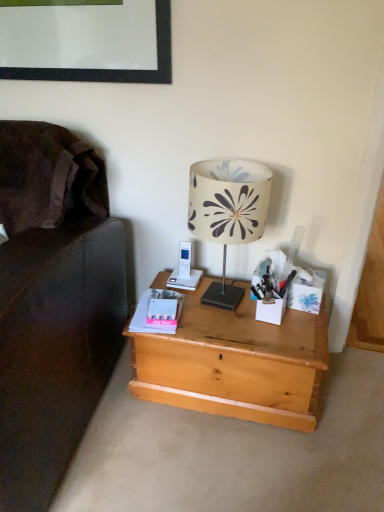
I want to click on free space in front of white fabric lampshade at center, so click(x=243, y=334).